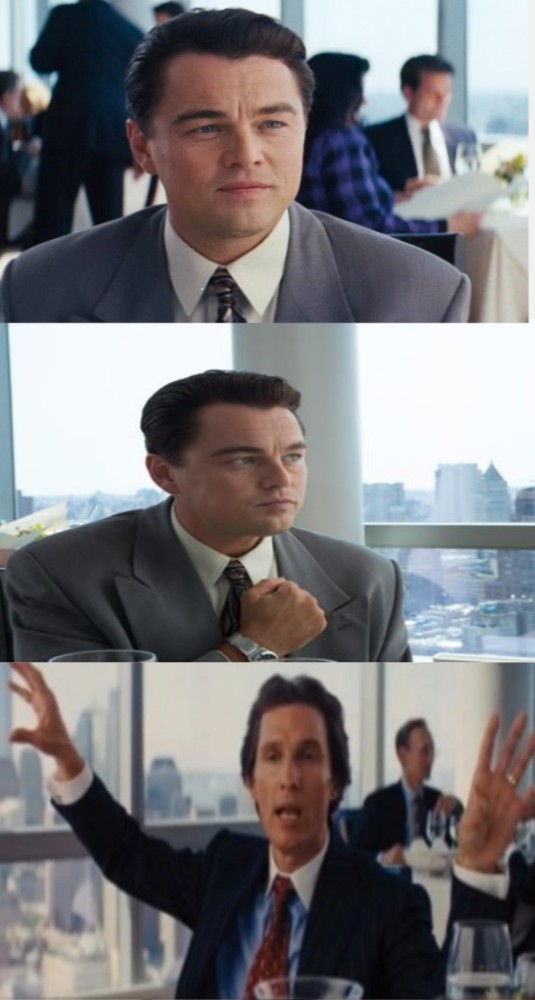
Image resolution: width=535 pixels, height=1000 pixels. I want to click on window, so point(207,772).